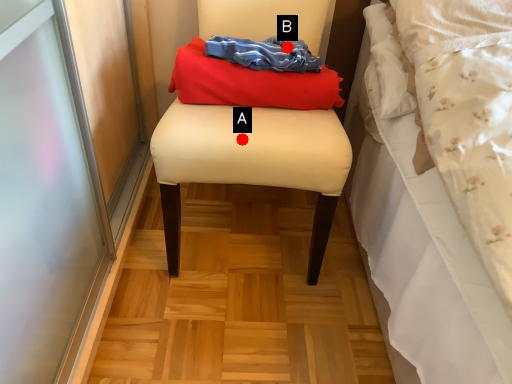
Question: Two points are circled on the image, labeled by A and B beside each circle. Which point is farther to the camera?

Choices:
 (A) A is further
 (B) B is further

Answer: (B)